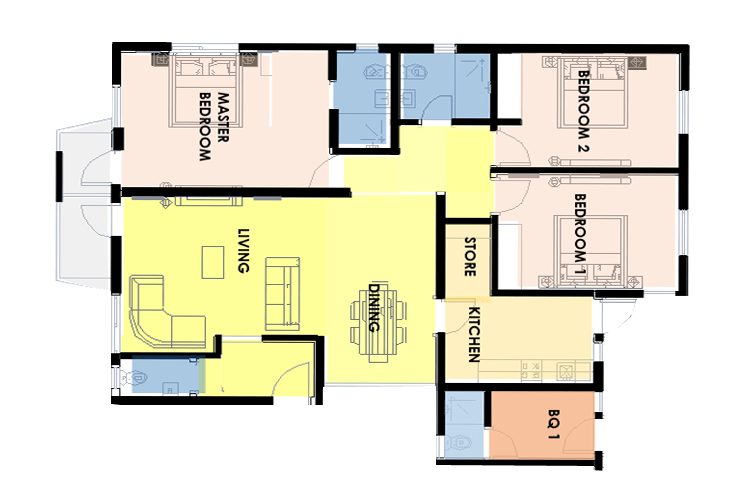
Locate an element on the screen. Image resolution: width=750 pixels, height=500 pixels. floorplan is located at coordinates (364, 137).